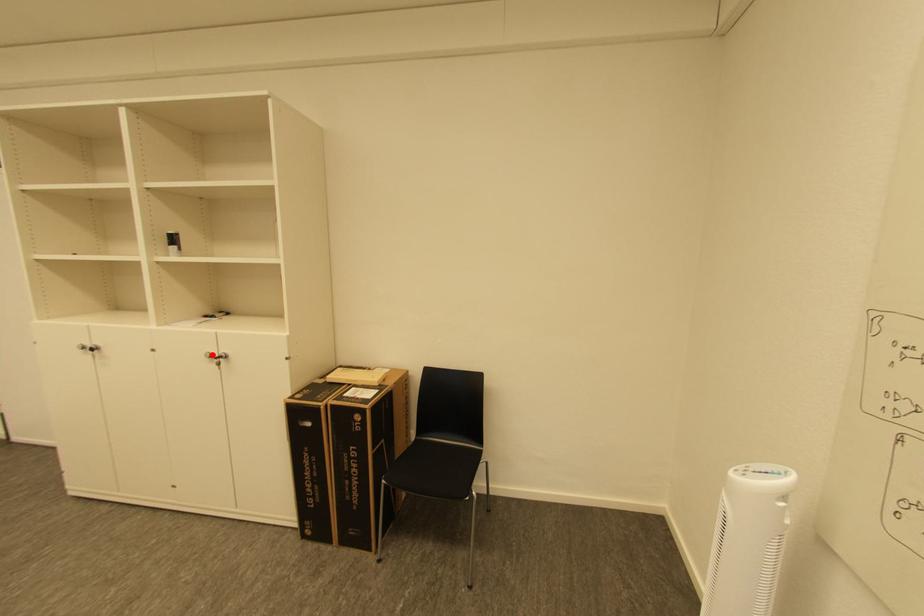
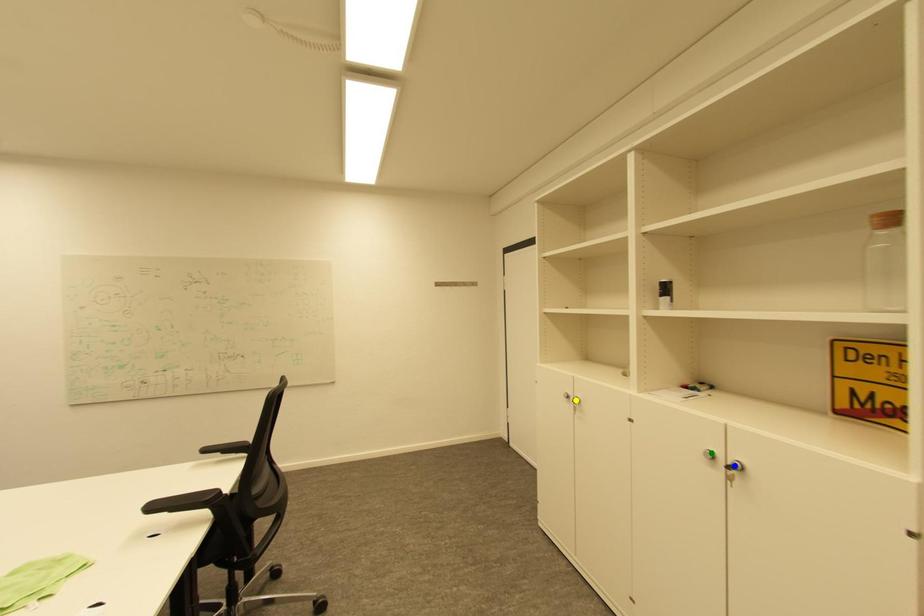
Question: I am providing you with two images of the same scene from different viewpoints. A red point is marked on the first image. You are given multiple points on the second image. Which point in image 2 represents the same 3d spot as the red point in image 1?

Choices:
 (A) blue point
 (B) green point
 (C) yellow point

Answer: (B)